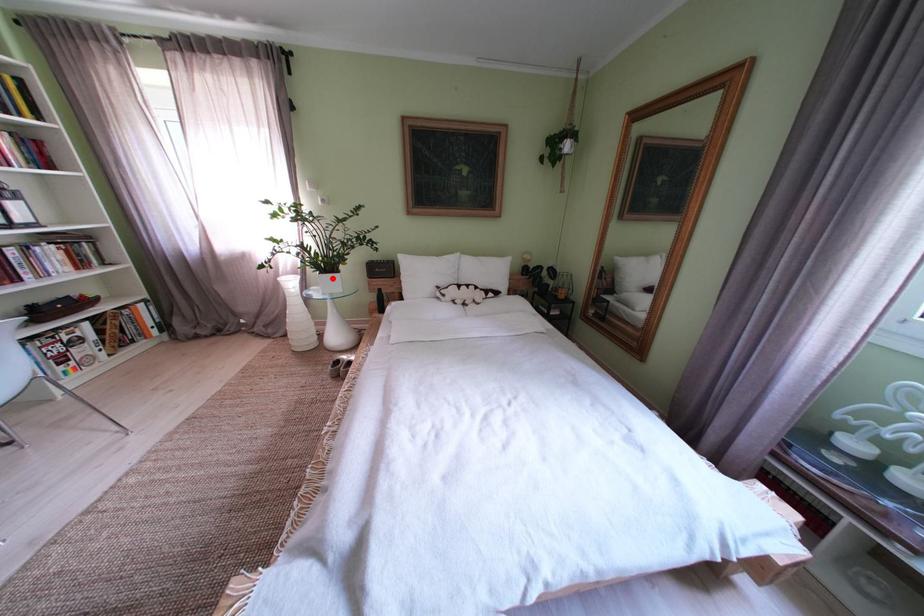
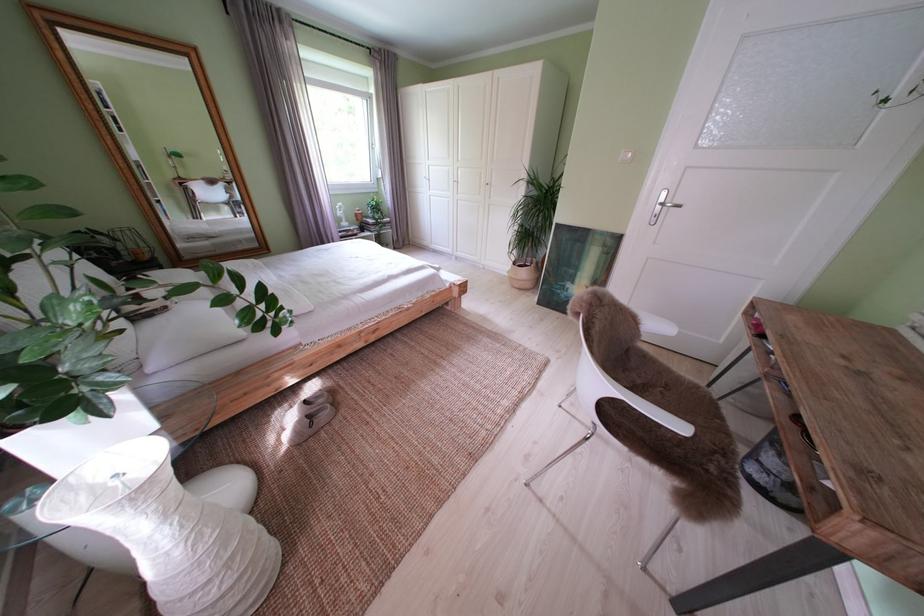
In the second image, find the point that corresponds to the highlighted location in the first image.

(112, 395)